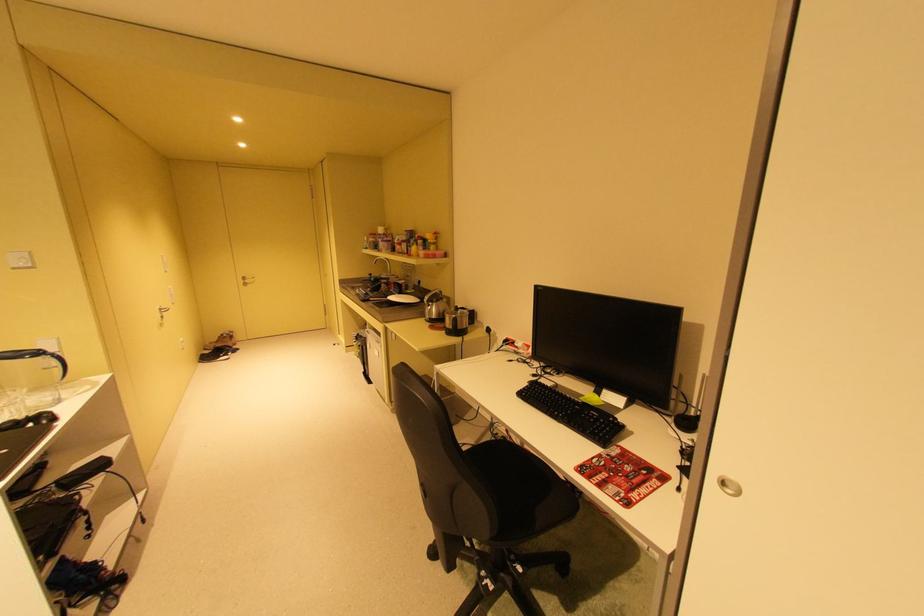
Find the location of a particular element. The image size is (924, 616). silver door handle is located at coordinates (247, 281).